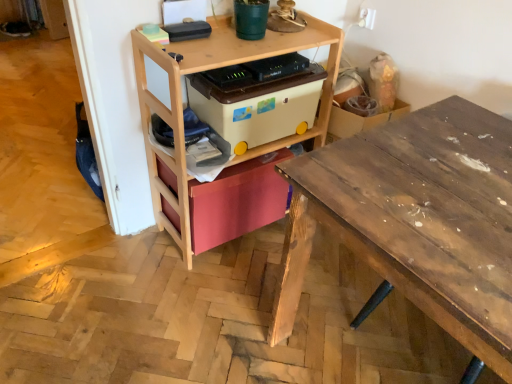
In order to click on vacant space that is to the left of wooden desk at right in this screenshot , I will do `click(213, 313)`.